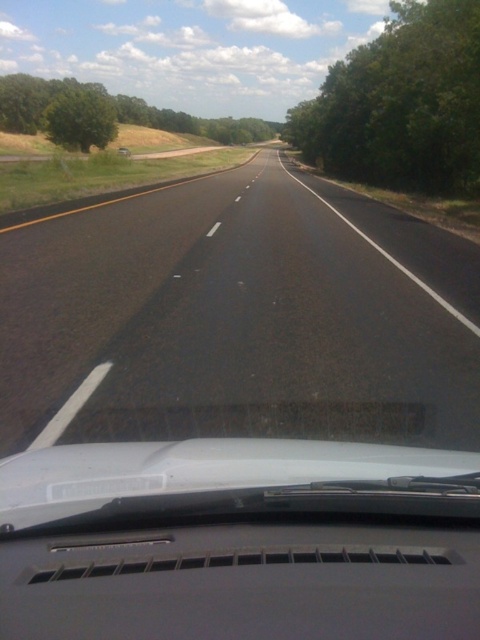
You are a driver planning to park your car between the green leafy tree at right and the green leafy tree at left. The car is 5 meters long. Can you fit the car in the space between them without touching either tree?

The distance between the green leafy tree at right and the green leafy tree at left is 37.72 meters. Since the car is only 5 meters long, there is more than enough space to park between them without touching either tree.

You are driving a car and want to know if the green leafy tree at right or the green leafy tree at left is closer to the road. Based on their thickness, which tree is thinner and therefore likely closer?

The green leafy tree at right is thinner than the green leafy tree at left, so it is likely closer to the road.

You are driving a car with a trunk that is 5 feet long. You need to park your car so that the trunk reaches exactly to point (132, 632). If your car is currently 6.93 feet away from that point, how much further do you need to drive forward to reach the desired parking spot?

The distance between the camera and point (132, 632) is 6.93 feet. Since the trunk is 5 feet long, you need to drive forward an additional 1.93 feet to ensure the trunk reaches the point.